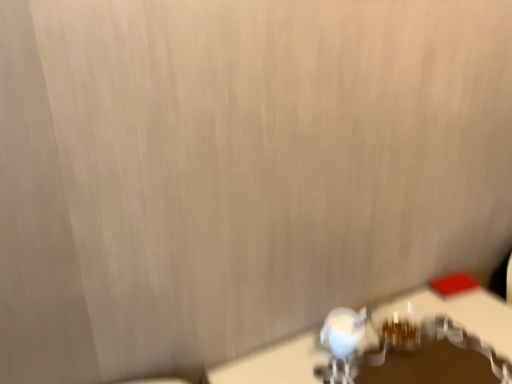
Question: From their relative heights in the image, would you say white glossy table at lower right is taller or shorter than white glossy faucet at lower center?

Choices:
 (A) short
 (B) tall

Answer: (B)

Question: In terms of width, does white glossy table at lower right look wider or thinner when compared to white glossy faucet at lower center?

Choices:
 (A) thin
 (B) wide

Answer: (B)

Question: Considering the positions of white glossy table at lower right and white glossy faucet at lower center in the image, is white glossy table at lower right bigger or smaller than white glossy faucet at lower center?

Choices:
 (A) big
 (B) small

Answer: (A)

Question: From a real-world perspective, is white glossy faucet at lower center positioned above or below white glossy table at lower right?

Choices:
 (A) above
 (B) below

Answer: (A)

Question: Relative to white glossy table at lower right, is white glossy faucet at lower center in front or behind?

Choices:
 (A) behind
 (B) front

Answer: (A)

Question: Considering the positions of point (353, 316) and point (391, 307), is point (353, 316) closer or farther from the camera than point (391, 307)?

Choices:
 (A) closer
 (B) farther

Answer: (A)

Question: In terms of width, does white glossy faucet at lower center look wider or thinner when compared to white glossy table at lower right?

Choices:
 (A) thin
 (B) wide

Answer: (A)